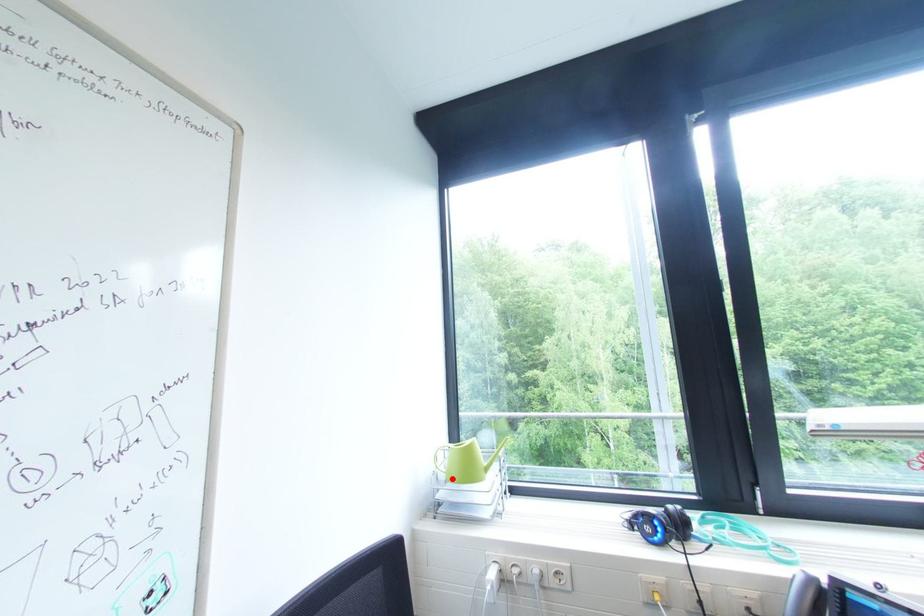
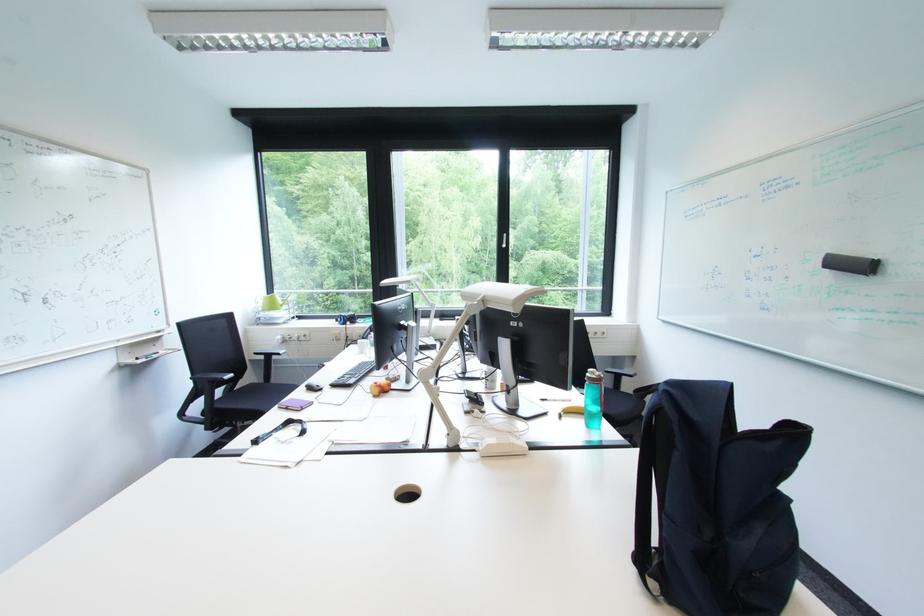
Question: I am providing you with two images of the same scene from different viewpoints. Given a red point in image1, look at the same physical point in image2. Is it:

Choices:
 (A) Closer to the viewpoint
 (B) Farther from the viewpoint

Answer: (A)